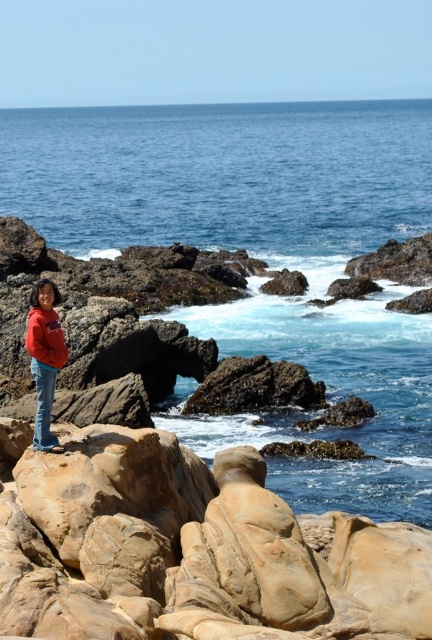
Between matte red hoodie at center and matte red jacket at lower left, which one is positioned lower?

Positioned lower is matte red hoodie at center.

Does matte red hoodie at center appear on the left side of matte red jacket at lower left?

Correct, you'll find matte red hoodie at center to the left of matte red jacket at lower left.

Which is in front, point (47, 282) or point (53, 349)?

Point (53, 349) is more forward.

The height and width of the screenshot is (640, 432). Find the location of `matte red hoodie at center`. matte red hoodie at center is located at coordinates (44, 356).

Between blue smooth water at center and matte red hoodie at center, which one is positioned higher?

blue smooth water at center is above.

Which is below, blue smooth water at center or matte red hoodie at center?

matte red hoodie at center is below.

This screenshot has height=640, width=432. I want to click on blue smooth water at center, so click(x=221, y=176).

Which is more to the right, blue smooth water at center or matte red jacket at lower left?

From the viewer's perspective, blue smooth water at center appears more on the right side.

Can you confirm if blue smooth water at center is bigger than matte red jacket at lower left?

Yes.

Does point (295, 192) come behind point (63, 340)?

That is True.

Locate an element on the screen. This screenshot has height=640, width=432. blue smooth water at center is located at coordinates (221, 176).